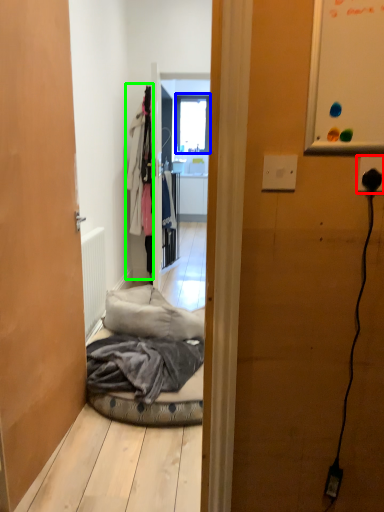
Question: Considering the real-world distances, which object is closest to electric outlet (highlighted by a red box)? window (highlighted by a blue box) or clothing (highlighted by a green box).

Choices:
 (A) window
 (B) clothing

Answer: (B)